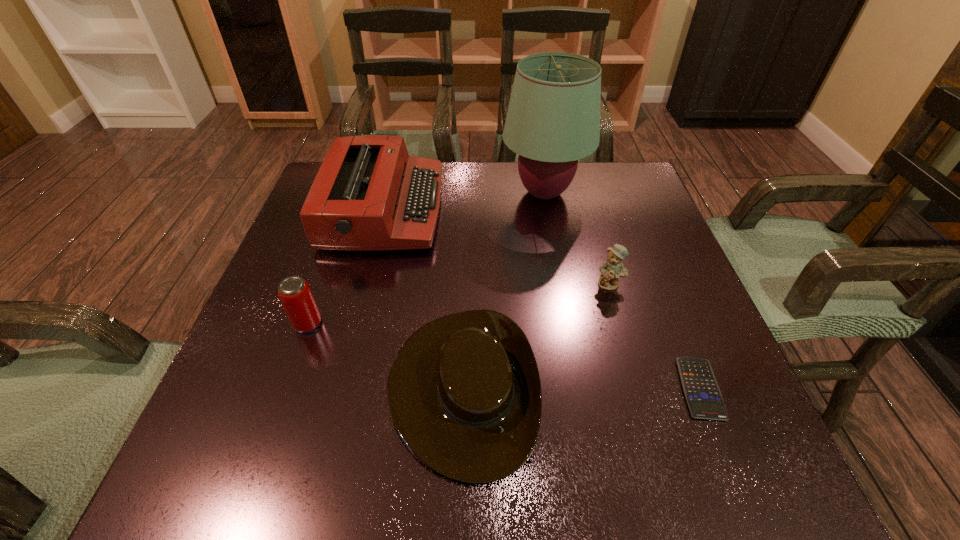
Where is `vacant space that satisfies the following two spatial constraints: 1. on the typing side of the typewriter; 2. on the left side of the shortest object`? vacant space that satisfies the following two spatial constraints: 1. on the typing side of the typewriter; 2. on the left side of the shortest object is located at coordinates (339, 388).

I want to click on vacant position in the image that satisfies the following two spatial constraints: 1. on the typing side of the typewriter; 2. on the left side of the calculator, so click(x=339, y=388).

Find the location of `vacant point that satisfies the following two spatial constraints: 1. on the typing side of the typewriter; 2. on the front side of the beer can`. vacant point that satisfies the following two spatial constraints: 1. on the typing side of the typewriter; 2. on the front side of the beer can is located at coordinates (355, 323).

The image size is (960, 540). In order to click on vacant space that satisfies the following two spatial constraints: 1. on the typing side of the cowboy hat; 2. on the left side of the typewriter in this screenshot , I will do `click(339, 387)`.